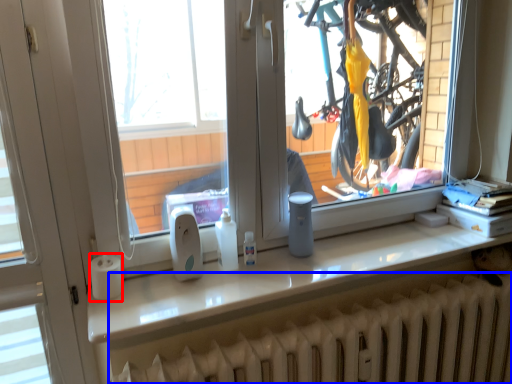
Question: Which object appears farthest to the camera in this image, paper towel (highlighted by a red box) or radiator (highlighted by a blue box)?

Choices:
 (A) paper towel
 (B) radiator

Answer: (A)